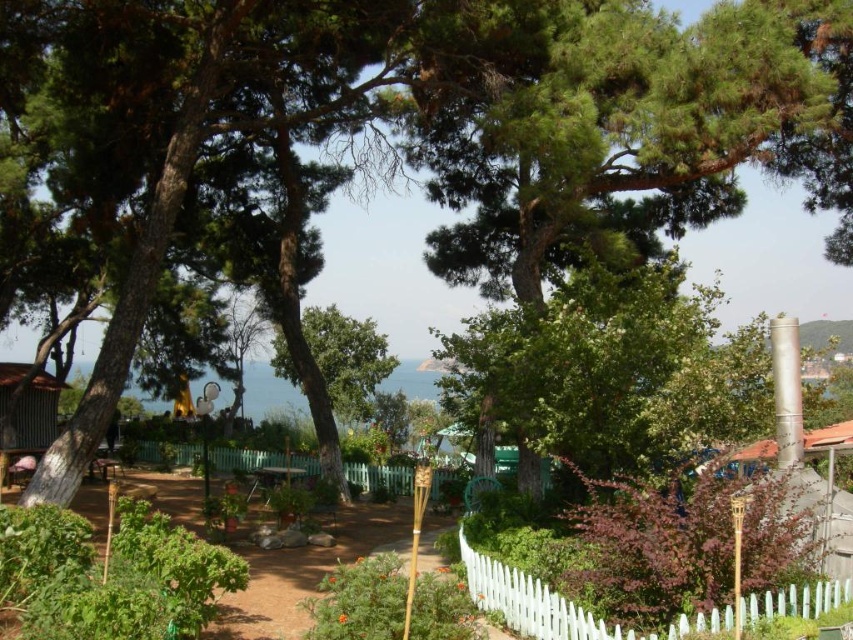
Question: Which point appears farthest from the camera in this image?

Choices:
 (A) (646, 390)
 (B) (392, 481)
 (C) (477, 554)

Answer: (B)

Question: Which point is farther to the camera?

Choices:
 (A) (375, 465)
 (B) (624, 288)
 (C) (775, 596)

Answer: (A)

Question: From the image, what is the correct spatial relationship of white picket fence at center in relation to green wooden fence at center?

Choices:
 (A) above
 (B) below

Answer: (A)

Question: Can you confirm if wooden hut at right is wider than green wooden fence at center?

Choices:
 (A) no
 (B) yes

Answer: (A)

Question: Which point is closer to the camera?

Choices:
 (A) (358, 385)
 (B) (809, 592)
 (C) (558, 401)

Answer: (B)

Question: Is white picket fence at center smaller than green wooden fence at center?

Choices:
 (A) yes
 (B) no

Answer: (A)